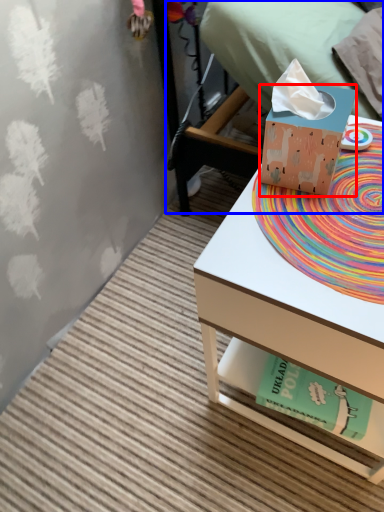
Question: Among these objects, which one is nearest to the camera, box (highlighted by a red box) or bed (highlighted by a blue box)?

Choices:
 (A) box
 (B) bed

Answer: (A)